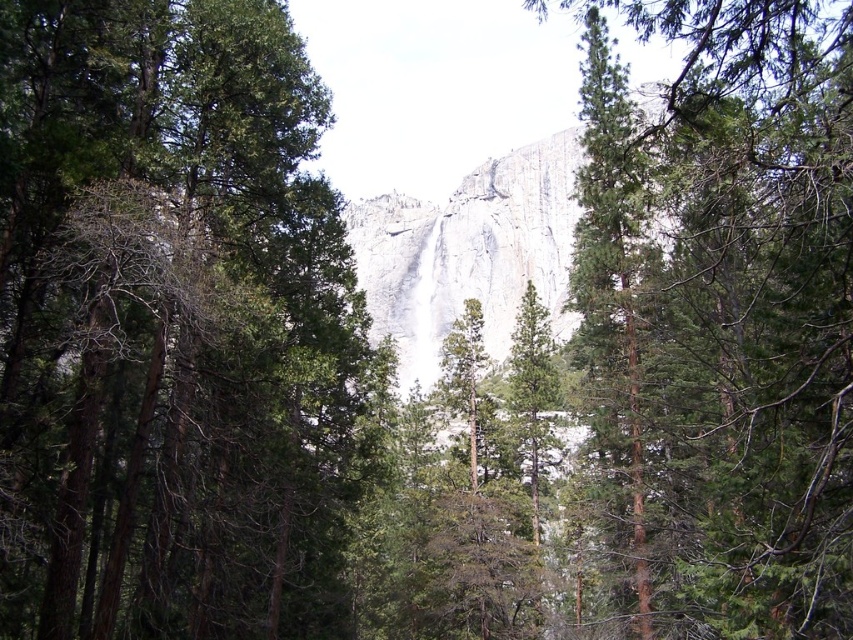
Is gray rock face at center taller than green textured tree at center?

Indeed, gray rock face at center has a greater height compared to green textured tree at center.

Does gray rock face at center have a lesser width compared to green textured tree at center?

In fact, gray rock face at center might be wider than green textured tree at center.

Locate an element on the screen. The height and width of the screenshot is (640, 853). gray rock face at center is located at coordinates (469, 252).

Between green matte tree at center and green coniferous tree at center, which one appears on the right side from the viewer's perspective?

green coniferous tree at center is more to the right.

Between point (175, 528) and point (592, 212), which one is positioned in front?

Point (175, 528)

The width and height of the screenshot is (853, 640). What are the coordinates of `green matte tree at center` in the screenshot? It's located at (171, 326).

Consider the image. Which of these two, green matte tree at center or gray rock face at center, stands shorter?

green matte tree at center is shorter.

Between green matte tree at center and gray rock face at center, which one is positioned lower?

green matte tree at center is below.

Is point (242, 333) positioned before point (383, 211)?

Yes, point (242, 333) is in front of point (383, 211).

Find the location of a particular element. green matte tree at center is located at coordinates (171, 326).